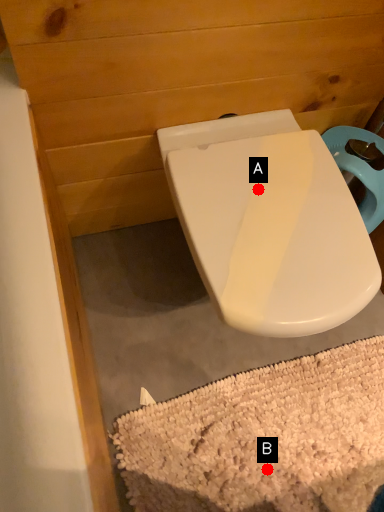
Question: Two points are circled on the image, labeled by A and B beside each circle. Which point appears farthest from the camera in this image?

Choices:
 (A) A is further
 (B) B is further

Answer: (B)